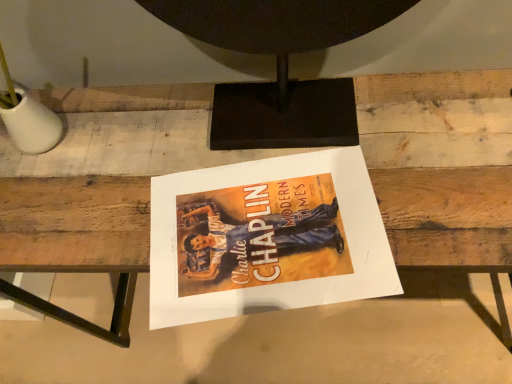
The width and height of the screenshot is (512, 384). I want to click on free region under wooden table at center (from a real-world perspective), so click(326, 326).